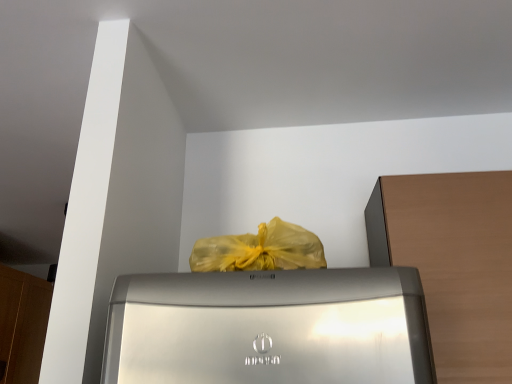
Question: In terms of width, does brown wood cabinet at right, which ranks as the 1th cabinetry in front-to-back order, look wider or thinner when compared to wooden cabinet at left, the 1th cabinetry when ordered from back to front?

Choices:
 (A) wide
 (B) thin

Answer: (A)

Question: From a real-world perspective, is brown wood cabinet at right, which ranks as the 1th cabinetry in front-to-back order, physically located above or below wooden cabinet at left, positioned as the second cabinetry in right-to-left order?

Choices:
 (A) below
 (B) above

Answer: (A)

Question: Considering the positions of point (385, 251) and point (4, 304), is point (385, 251) closer or farther from the camera than point (4, 304)?

Choices:
 (A) closer
 (B) farther

Answer: (A)

Question: Is wooden cabinet at left, the second cabinetry viewed from the front, bigger or smaller than brown wood cabinet at right, the 1th cabinetry positioned from the right?

Choices:
 (A) small
 (B) big

Answer: (A)

Question: Is wooden cabinet at left, which appears as the 1th cabinetry when viewed from the left, to the left or to the right of brown wood cabinet at right, placed as the 2th cabinetry when sorted from back to front, in the image?

Choices:
 (A) left
 (B) right

Answer: (A)

Question: From the image's perspective, is wooden cabinet at left, which appears as the 1th cabinetry when viewed from the left, above or below brown wood cabinet at right, placed as the 2th cabinetry when sorted from back to front?

Choices:
 (A) below
 (B) above

Answer: (A)

Question: Is wooden cabinet at left, the 1th cabinetry when ordered from back to front, situated inside brown wood cabinet at right, the 1th cabinetry positioned from the right, or outside?

Choices:
 (A) inside
 (B) outside

Answer: (B)